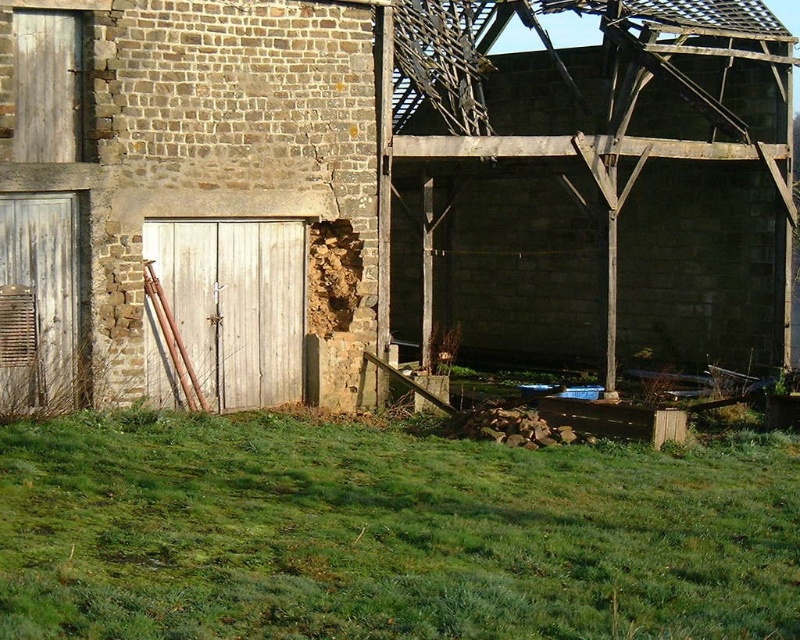
Question: Which point is farther to the camera?

Choices:
 (A) (630, 627)
 (B) (684, 97)

Answer: (B)

Question: Can you confirm if rustic wooden barn at center is bigger than green grass at lower center?

Choices:
 (A) yes
 (B) no

Answer: (A)

Question: Can you confirm if rustic wooden barn at center is positioned below green grass at lower center?

Choices:
 (A) no
 (B) yes

Answer: (A)

Question: Observing the image, what is the correct spatial positioning of rustic wooden barn at center in reference to green grass at lower center?

Choices:
 (A) left
 (B) right

Answer: (A)